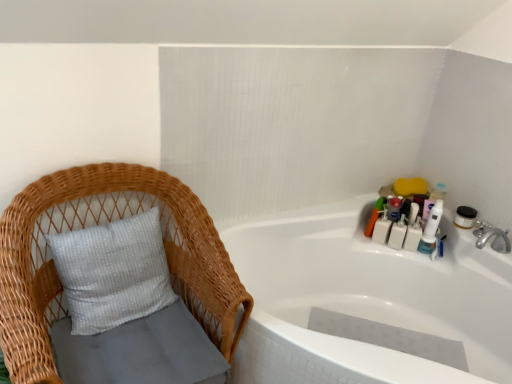
What do you see at coordinates (413, 236) in the screenshot? I see `white plastic toothbrush at upper right, the 5th toiletry viewed from the left` at bounding box center [413, 236].

Measure the distance between point (278, 360) and camera.

They are 4.51 feet apart.

You are a GUI agent. You are given a task and a screenshot of the screen. Output one action in this format:
    pyautogui.click(x=<x>, y=<y>)
    Task: Click on the woven wood chair at left
    This screenshot has height=384, width=512.
    Given the screenshot: What is the action you would take?
    pyautogui.click(x=97, y=224)

What do you see at coordinates (382, 229) in the screenshot?
I see `white plastic bottles at upper right, the fifth toiletry when ordered from right to left` at bounding box center [382, 229].

Where is `matte plastic toothbrush at upper right, the sixth toiletry when ordered from right to left`? The width and height of the screenshot is (512, 384). matte plastic toothbrush at upper right, the sixth toiletry when ordered from right to left is located at coordinates (375, 215).

Identify the location of white plastic bottles at upper right, the fourth toiletry in the right-to-left sequence. (397, 234).

Which point is more distant from viewer, (382, 207) or (385, 216)?

The point (382, 207) is farther.

Would you say matte plastic toothbrush at upper right, which is the first toiletry from left to right, is inside or outside white plastic bottles at upper right, which is the second toiletry in left-to-right order?

matte plastic toothbrush at upper right, which is the first toiletry from left to right, is not inside white plastic bottles at upper right, which is the second toiletry in left-to-right order, it's outside.

Considering the sizes of objects matte plastic toothbrush at upper right, which is the first toiletry from left to right, and white plastic bottles at upper right, which is the second toiletry in left-to-right order, in the image provided, who is smaller, matte plastic toothbrush at upper right, which is the first toiletry from left to right, or white plastic bottles at upper right, which is the second toiletry in left-to-right order,?

white plastic bottles at upper right, which is the second toiletry in left-to-right order.

Considering the sizes of objects matte plastic toothbrush at upper right, which is the first toiletry from left to right, and white plastic bottles at upper right, the fifth toiletry when ordered from right to left, in the image provided, who is taller, matte plastic toothbrush at upper right, which is the first toiletry from left to right, or white plastic bottles at upper right, the fifth toiletry when ordered from right to left,?

matte plastic toothbrush at upper right, which is the first toiletry from left to right.

In the image, is woven wood chair at left on the left side or the right side of translucent plastic bottle at upper right, marked as the fourth toiletry in a left-to-right arrangement?

In the image, woven wood chair at left appears on the left side of translucent plastic bottle at upper right, marked as the fourth toiletry in a left-to-right arrangement.

Is woven wood chair at left in contact with translucent plastic bottle at upper right, marked as the fourth toiletry in a left-to-right arrangement?

No.

Is woven wood chair at left looking in the opposite direction of translucent plastic bottle at upper right, marked as the fourth toiletry in a left-to-right arrangement?

No, translucent plastic bottle at upper right, marked as the fourth toiletry in a left-to-right arrangement, is not at the back of woven wood chair at left.

Who is shorter, woven wood chair at left or translucent plastic bottle at upper right, marked as the fourth toiletry in a left-to-right arrangement?

With less height is translucent plastic bottle at upper right, marked as the fourth toiletry in a left-to-right arrangement.

Considering the sizes of objects translucent plastic bottle at upper right, the third toiletry from the right, and matte plastic toothbrush at upper right, which is the first toiletry from left to right, in the image provided, who is taller, translucent plastic bottle at upper right, the third toiletry from the right, or matte plastic toothbrush at upper right, which is the first toiletry from left to right,?

Standing taller between the two is matte plastic toothbrush at upper right, which is the first toiletry from left to right.

Looking at this image, can you tell me how much translucent plastic bottle at upper right, the third toiletry from the right, and matte plastic toothbrush at upper right, the sixth toiletry when ordered from right to left, differ in facing direction?

There is a 0.00823-degree angle between the facing directions of translucent plastic bottle at upper right, the third toiletry from the right, and matte plastic toothbrush at upper right, the sixth toiletry when ordered from right to left.

From the picture: Is there a large distance between translucent plastic bottle at upper right, marked as the fourth toiletry in a left-to-right arrangement, and matte plastic toothbrush at upper right, the sixth toiletry when ordered from right to left?

They are positioned close to each other.

Does translucent plastic bottle at upper right, marked as the fourth toiletry in a left-to-right arrangement, lie in front of matte plastic toothbrush at upper right, which is the first toiletry from left to right?

No, the depth of translucent plastic bottle at upper right, marked as the fourth toiletry in a left-to-right arrangement, is greater than that of matte plastic toothbrush at upper right, which is the first toiletry from left to right.

Would you say matte plastic toothbrush at upper right, which is the first toiletry from left to right, is inside or outside woven wood chair at left?

matte plastic toothbrush at upper right, which is the first toiletry from left to right, is located beyond the bounds of woven wood chair at left.

Based on the photo, could you tell me if matte plastic toothbrush at upper right, which is the first toiletry from left to right, is turned towards woven wood chair at left?

No.

How distant is matte plastic toothbrush at upper right, the sixth toiletry when ordered from right to left, from woven wood chair at left?

A distance of 4.04 feet exists between matte plastic toothbrush at upper right, the sixth toiletry when ordered from right to left, and woven wood chair at left.

Is matte plastic toothbrush at upper right, which is the first toiletry from left to right, wider than woven wood chair at left?

No.

Is translucent plastic bottle at upper right, marked as the fourth toiletry in a left-to-right arrangement, inside or outside of white plastic bottles at upper right, the fifth toiletry when ordered from right to left?

translucent plastic bottle at upper right, marked as the fourth toiletry in a left-to-right arrangement, is not inside white plastic bottles at upper right, the fifth toiletry when ordered from right to left, it's outside.

Is translucent plastic bottle at upper right, marked as the fourth toiletry in a left-to-right arrangement, shorter than white plastic bottles at upper right, which is the second toiletry in left-to-right order?

Yes.

From a real-world perspective, starting from the white plastic bottles at upper right, the fifth toiletry when ordered from right to left, which toiletry is the 3rd one vertically above it? Please provide its 2D coordinates.

[(394, 208)]

From the image's perspective, is woven wood chair at left located above or below matte plastic toothbrush at upper right, which is the first toiletry from left to right?

woven wood chair at left is situated lower than matte plastic toothbrush at upper right, which is the first toiletry from left to right, in the image.

Is woven wood chair at left facing towards matte plastic toothbrush at upper right, the sixth toiletry when ordered from right to left?

No.

Is woven wood chair at left inside the boundaries of matte plastic toothbrush at upper right, the sixth toiletry when ordered from right to left, or outside?

woven wood chair at left cannot be found inside matte plastic toothbrush at upper right, the sixth toiletry when ordered from right to left.

Find the location of a particular element. This screenshot has width=512, height=384. the 4th toiletry positioned above the woven wood chair at left (from a real-world perspective) is located at coordinates (375, 215).

Does point (417, 241) appear closer or farther from the camera than point (389, 213)?

Point (417, 241) is positioned closer to the camera compared to point (389, 213).

Is white plastic toothbrush at upper right, acting as the 2th toiletry starting from the right, bigger or smaller than translucent plastic bottle at upper right, marked as the fourth toiletry in a left-to-right arrangement?

white plastic toothbrush at upper right, acting as the 2th toiletry starting from the right, is bigger than translucent plastic bottle at upper right, marked as the fourth toiletry in a left-to-right arrangement.

Considering the relative positions of white plastic toothbrush at upper right, the 5th toiletry viewed from the left, and translucent plastic bottle at upper right, marked as the fourth toiletry in a left-to-right arrangement, in the image provided, is white plastic toothbrush at upper right, the 5th toiletry viewed from the left, to the left of translucent plastic bottle at upper right, marked as the fourth toiletry in a left-to-right arrangement, from the viewer's perspective?

In fact, white plastic toothbrush at upper right, the 5th toiletry viewed from the left, is to the right of translucent plastic bottle at upper right, marked as the fourth toiletry in a left-to-right arrangement.

Is white plastic toothbrush at upper right, the 5th toiletry viewed from the left, in contact with translucent plastic bottle at upper right, marked as the fourth toiletry in a left-to-right arrangement?

No, white plastic toothbrush at upper right, the 5th toiletry viewed from the left, is not in contact with translucent plastic bottle at upper right, marked as the fourth toiletry in a left-to-right arrangement.

From the image's perspective, which toiletry is the 2nd one above the white plastic bottles at upper right, the fifth toiletry when ordered from right to left? Please provide its 2D coordinates.

[(375, 215)]

Image resolution: width=512 pixels, height=384 pixels. I want to click on furniture below the translucent plastic bottle at upper right, the third toiletry from the right (from a real-world perspective), so click(x=97, y=224).

Based on their spatial positions, is white plastic bottles at upper right, which is the second toiletry in left-to-right order, or woven wood chair at left further from matte plastic toothbrush at upper right, the sixth toiletry when ordered from right to left?

woven wood chair at left.

Which object lies further to the anchor point matte plastic toothbrush at upper right, the sixth toiletry when ordered from right to left, white plastic bottles at upper right, the fourth toiletry in the right-to-left sequence, or white plastic toothbrush at upper right, acting as the 2th toiletry starting from the right?

The object further to matte plastic toothbrush at upper right, the sixth toiletry when ordered from right to left, is white plastic toothbrush at upper right, acting as the 2th toiletry starting from the right.

When comparing their distances from white plastic bottles at upper right, which is the second toiletry in left-to-right order, does white plastic toothbrush at upper right, acting as the 2th toiletry starting from the right, or white plastic toothbrush at upper right, which is the 6th toiletry from left to right, seem closer?

Among the two, white plastic toothbrush at upper right, acting as the 2th toiletry starting from the right, is located nearer to white plastic bottles at upper right, which is the second toiletry in left-to-right order.

Considering their positions, is white glossy bathtub at upper right positioned closer to white plastic toothbrush at upper right, which is the 6th toiletry from left to right, than white plastic bottles at upper right, the fourth toiletry in the right-to-left sequence?

white plastic bottles at upper right, the fourth toiletry in the right-to-left sequence, is closer to white plastic toothbrush at upper right, which is the 6th toiletry from left to right.

Based on their spatial positions, is woven wood chair at left or white plastic toothbrush at upper right, acting as the 2th toiletry starting from the right, closer to white plastic toothbrush at upper right, which is counted as the first toiletry, starting from the right?

Among the two, white plastic toothbrush at upper right, acting as the 2th toiletry starting from the right, is located nearer to white plastic toothbrush at upper right, which is counted as the first toiletry, starting from the right.

From the image, which object appears to be farther from matte plastic toothbrush at upper right, which is the first toiletry from left to right, white plastic toothbrush at upper right, the 5th toiletry viewed from the left, or white plastic bottles at upper right, the fifth toiletry when ordered from right to left?

white plastic toothbrush at upper right, the 5th toiletry viewed from the left, is further to matte plastic toothbrush at upper right, which is the first toiletry from left to right.

Estimate the real-world distances between objects in this image. Which object is further from white plastic bottles at upper right, positioned as the 3th toiletry in left-to-right order, woven wood chair at left or white plastic toothbrush at upper right, the 5th toiletry viewed from the left?

Based on the image, woven wood chair at left appears to be further to white plastic bottles at upper right, positioned as the 3th toiletry in left-to-right order.

Which object lies further to the anchor point translucent plastic bottle at upper right, the third toiletry from the right, white plastic toothbrush at upper right, which is the 6th toiletry from left to right, or white plastic bottles at upper right, positioned as the 3th toiletry in left-to-right order?

The object further to translucent plastic bottle at upper right, the third toiletry from the right, is white plastic toothbrush at upper right, which is the 6th toiletry from left to right.

You are a GUI agent. You are given a task and a screenshot of the screen. Output one action in this format:
    pyautogui.click(x=<x>, y=<y>)
    Task: Click on the bathtub between woven wood chair at left and white plastic bottles at upper right, the fourth toiletry in the right-to-left sequence, in the front-back direction
    Image resolution: width=512 pixels, height=384 pixels.
    Given the screenshot: What is the action you would take?
    pyautogui.click(x=365, y=300)

This screenshot has height=384, width=512. Find the location of `bathtub located between woven wood chair at left and matte plastic toothbrush at upper right, the sixth toiletry when ordered from right to left, in the depth direction`. bathtub located between woven wood chair at left and matte plastic toothbrush at upper right, the sixth toiletry when ordered from right to left, in the depth direction is located at coordinates (365, 300).

The height and width of the screenshot is (384, 512). I want to click on bathtub between woven wood chair at left and translucent plastic bottle at upper right, the third toiletry from the right, along the z-axis, so click(x=365, y=300).

This screenshot has height=384, width=512. I want to click on toiletry positioned between white glossy bathtub at upper right and white plastic toothbrush at upper right, the 5th toiletry viewed from the left, from near to far, so click(431, 230).